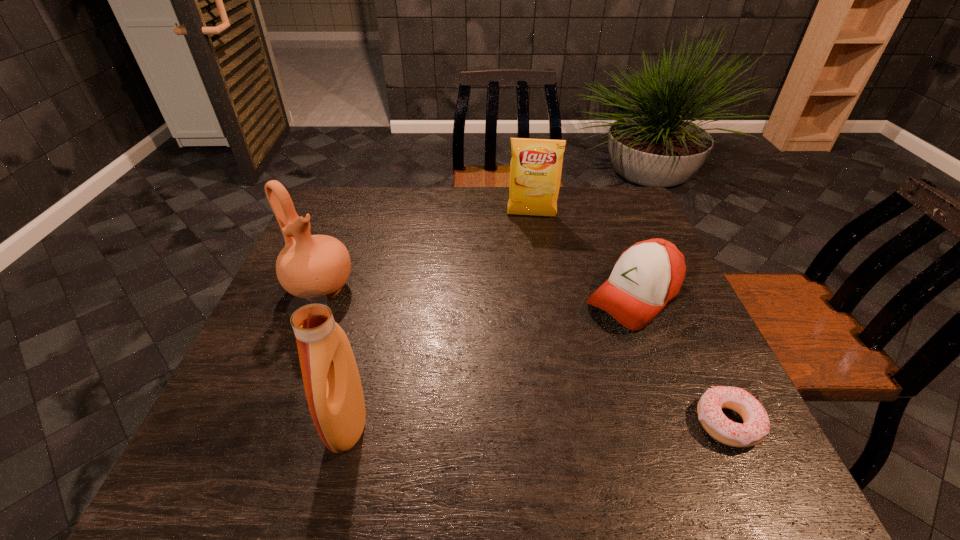
At what (x,y) coordinates should I click in order to perform the action: click on the fourth object from right to left. Please return your answer as a coordinate pair (x, y). Looking at the image, I should click on (332, 383).

Where is `the shortest object`? The width and height of the screenshot is (960, 540). the shortest object is located at coordinates (756, 425).

Image resolution: width=960 pixels, height=540 pixels. What are the coordinates of `crisp (potato chip)` in the screenshot? It's located at (536, 165).

The width and height of the screenshot is (960, 540). Identify the location of the third object from right to left. (536, 165).

This screenshot has height=540, width=960. Find the location of `the leftmost object`. the leftmost object is located at coordinates (308, 262).

Find the location of a particular element. The image size is (960, 540). baseball cap is located at coordinates (647, 276).

Identify the location of vacant space located 0.070m on the front-facing side of the fourth object from right to left. (294, 423).

You are a GUI agent. You are given a task and a screenshot of the screen. Output one action in this format:
    pyautogui.click(x=<x>, y=<y>)
    Task: Click on the free location located on the front-facing side of the fourth object from right to left
    The image size is (960, 540).
    Given the screenshot: What is the action you would take?
    click(299, 423)

I want to click on vacant space positioned 0.140m on the front-facing side of the fourth object from right to left, so click(256, 423).

This screenshot has height=540, width=960. Identify the location of free space located 0.370m on the back of the shortest object. (659, 275).